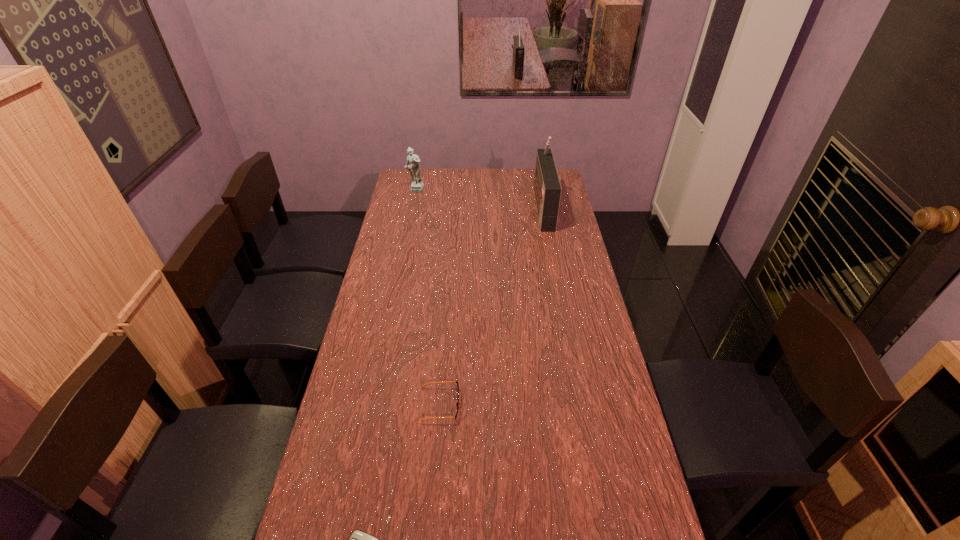
Find the location of a particular element. radio receiver present at the far edge is located at coordinates (547, 189).

Find the location of a particular element. This screenshot has height=540, width=960. figurine present at the far edge is located at coordinates (417, 185).

Image resolution: width=960 pixels, height=540 pixels. In order to click on object present at the left edge in this screenshot , I will do `click(417, 185)`.

Find the location of a particular element. object that is at the right edge is located at coordinates (547, 189).

This screenshot has height=540, width=960. In order to click on object situated at the far left corner in this screenshot , I will do `click(417, 185)`.

Find the location of a particular element. object present at the far right corner is located at coordinates (547, 189).

Where is `free region at the far edge of the desktop`? This screenshot has height=540, width=960. free region at the far edge of the desktop is located at coordinates (527, 179).

You are a GUI agent. You are given a task and a screenshot of the screen. Output one action in this format:
    pyautogui.click(x=<x>, y=<y>)
    Task: Click on the free space at the left edge of the desktop
    
    Given the screenshot: What is the action you would take?
    click(x=393, y=319)

Where is `blank space at the right edge of the desktop`? The width and height of the screenshot is (960, 540). blank space at the right edge of the desktop is located at coordinates (595, 419).

Identify the location of vacant area between the third shortest object and the rightmost object. The height and width of the screenshot is (540, 960). (479, 199).